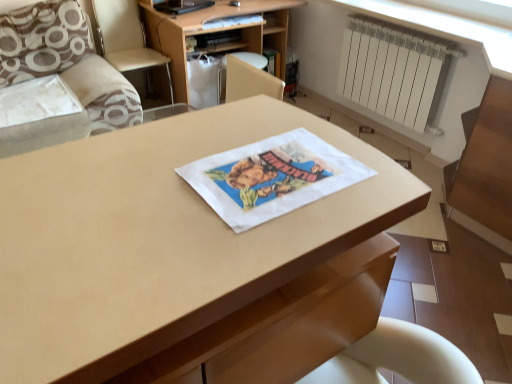
This screenshot has height=384, width=512. What are the coordinates of `free space above matte wood desk at center (from a real-world perspective)` in the screenshot? It's located at (179, 188).